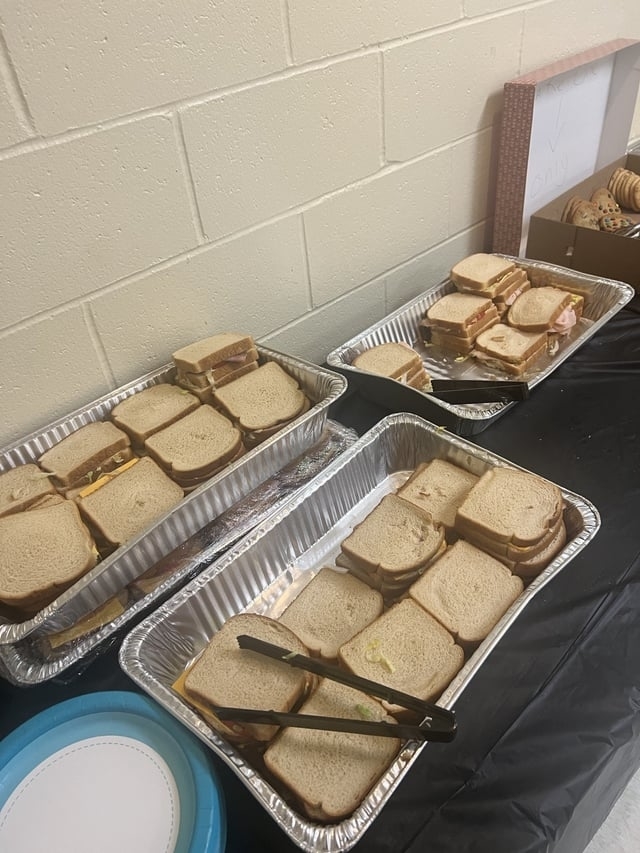
You are a GUI agent. You are given a task and a screenshot of the screen. Output one action in this format:
    pyautogui.click(x=<x>, y=<y>)
    Task: Click on the blue outer edge plate
    This screenshot has height=853, width=640.
    Given the screenshot: What is the action you would take?
    pyautogui.click(x=123, y=709)